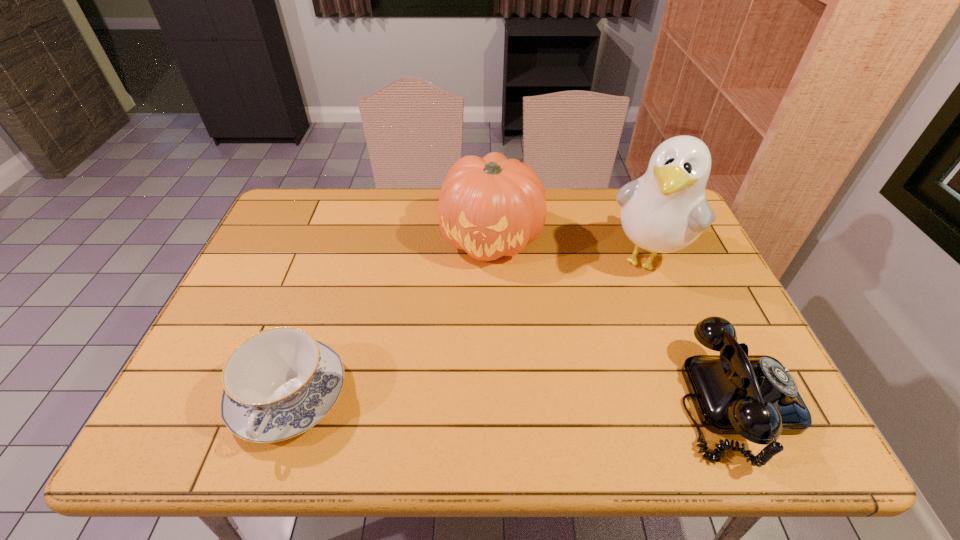
You are a GUI agent. You are given a task and a screenshot of the screen. Output one action in this format:
    pyautogui.click(x=<x>, y=<y>)
    Task: Click on the vacant region that satisfies the following two spatial constraints: 1. with the handle on the side of the telephone; 2. on the dial of the chinaware
    The width and height of the screenshot is (960, 540).
    Given the screenshot: What is the action you would take?
    pyautogui.click(x=287, y=401)